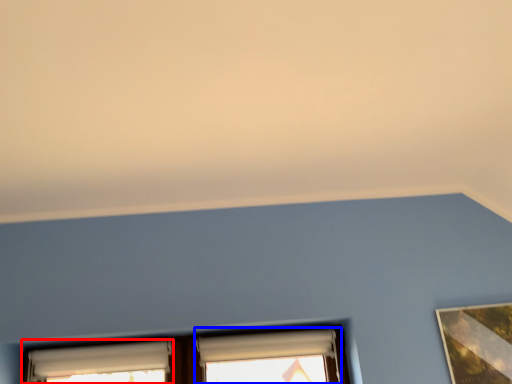
Question: Which of the following is the closest to the observer, window (highlighted by a red box) or window (highlighted by a blue box)?

Choices:
 (A) window
 (B) window

Answer: (A)